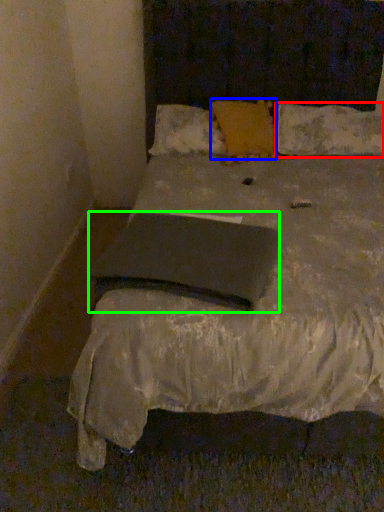
Question: Which object is the farthest from pillow (highlighted by a red box)? Choose among these: pillow (highlighted by a blue box) or pad (highlighted by a green box).

Choices:
 (A) pillow
 (B) pad

Answer: (B)